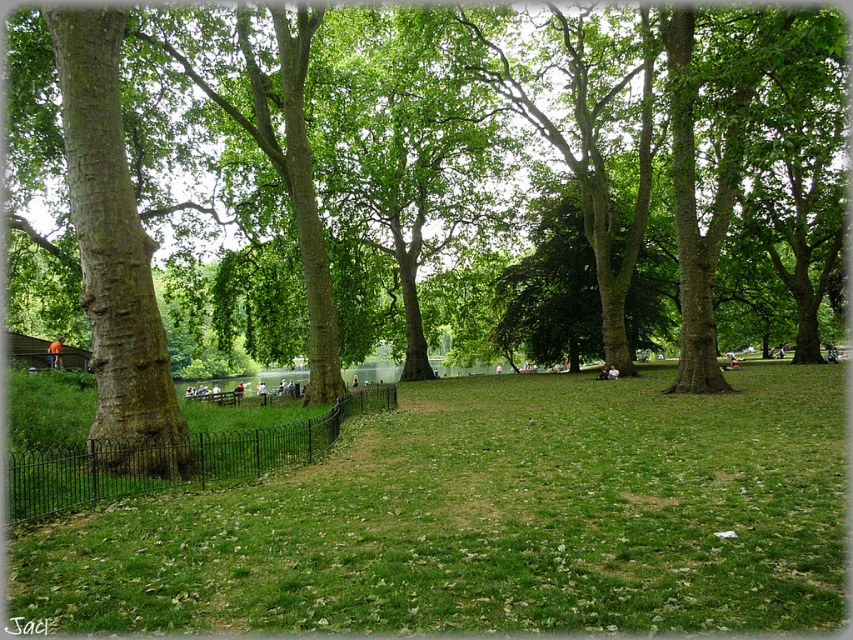
Consider the image. Is green matte tree at left smaller than green grassy area at center?

Incorrect, green matte tree at left is not smaller in size than green grassy area at center.

Can you confirm if green matte tree at left is positioned to the left of green grassy area at center?

Correct, you'll find green matte tree at left to the left of green grassy area at center.

Is point (386, 72) more distant than point (440, 381)?

No, it is in front of (440, 381).

The width and height of the screenshot is (853, 640). Identify the location of green matte tree at left. (434, 160).

Based on the photo, which is more to the right, green grassy area at center or black wrought iron fence at lower left?

green grassy area at center

You are a GUI agent. You are given a task and a screenshot of the screen. Output one action in this format:
    pyautogui.click(x=<x>, y=<y>)
    Task: Click on the green grassy area at center
    
    Given the screenshot: What is the action you would take?
    pyautogui.click(x=490, y=518)

The width and height of the screenshot is (853, 640). Find the location of `green grassy area at center`. green grassy area at center is located at coordinates (490, 518).

Is green matte tree at left to the left of black wrought iron fence at lower left from the viewer's perspective?

In fact, green matte tree at left is to the right of black wrought iron fence at lower left.

Is point (570, 145) closer to viewer compared to point (170, 474)?

No, (570, 145) is behind (170, 474).

Find the location of a particular element. The height and width of the screenshot is (640, 853). green matte tree at left is located at coordinates (434, 160).